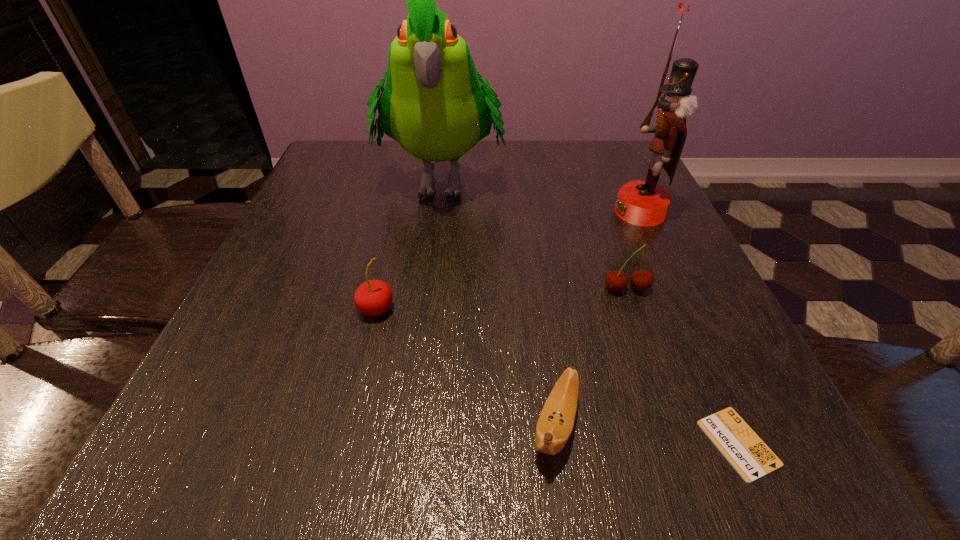
What are the coordinates of `identity card located in the right edge section of the desktop` in the screenshot? It's located at (741, 446).

The width and height of the screenshot is (960, 540). Find the location of `object present at the near right corner`. object present at the near right corner is located at coordinates (741, 446).

In the image, there is a desktop. Where is `vacant space at the far edge`? vacant space at the far edge is located at coordinates (525, 156).

Identify the location of free space at the near edge. (407, 477).

At what (x,y) coordinates should I click in order to perform the action: click on free space at the left edge of the desktop. Please return your answer as a coordinate pair (x, y). Looking at the image, I should click on (298, 225).

Where is `free space at the right edge`? The height and width of the screenshot is (540, 960). free space at the right edge is located at coordinates (687, 242).

Find the location of `free space at the far left corner of the desktop`. free space at the far left corner of the desktop is located at coordinates (372, 154).

Where is `free point at the far right corner`? The height and width of the screenshot is (540, 960). free point at the far right corner is located at coordinates (600, 180).

At what (x,y) coordinates should I click in order to perform the action: click on vacant region between the left cherry and the right cherry. Please return your answer as a coordinate pair (x, y). This screenshot has height=540, width=960. Looking at the image, I should click on (501, 299).

In order to click on vacant space that is in between the right cherry and the parakeet in this screenshot , I will do `click(534, 234)`.